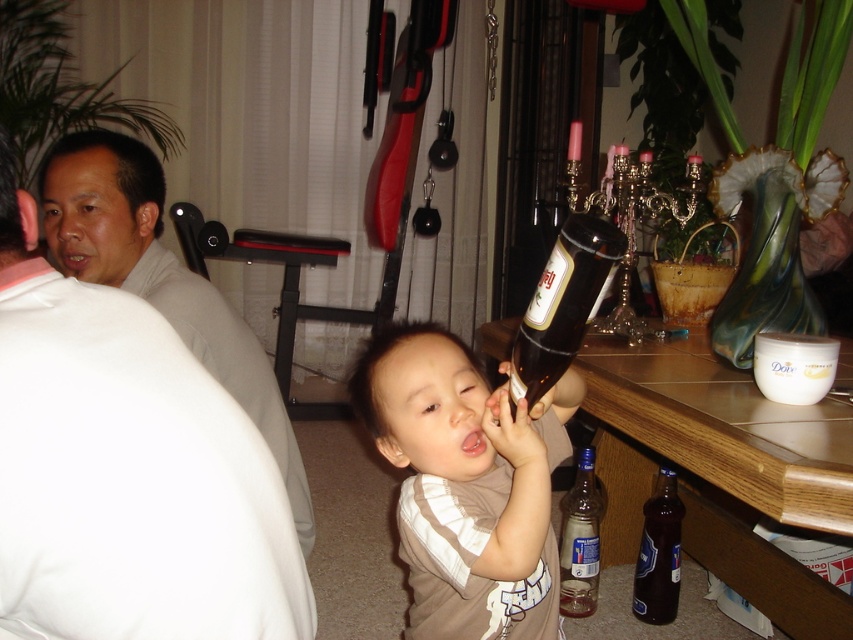
You are a photographer trying to capture a candid shot of the clear glass bottle at lower center without the matte white shirt at left blocking it. What should you do?

The matte white shirt at left is in front of the clear glass bottle at lower center, so you should move your camera position to the right to avoid the obstruction caused by the matte white shirt at left.

You are a photographer trying to capture a candid shot of the scene. You notice the matte white shirt at left and the brown matte hair at center. Which object should you focus on to ensure the subject is in the foreground?

The matte white shirt at left is much taller than the brown matte hair at center, so focusing on the matte white shirt at left would place it in the foreground since it is closer to the camera.